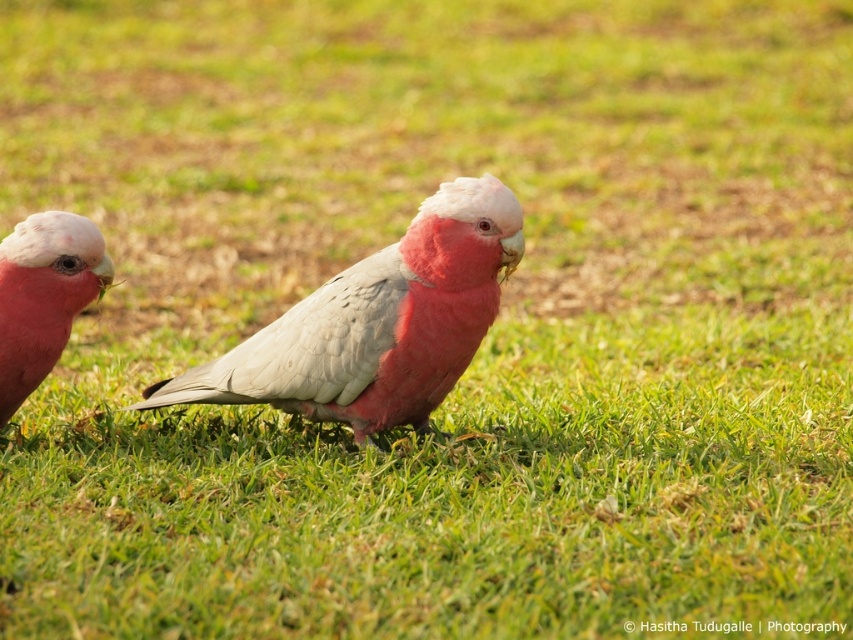
Question: Among these points, which one is nearest to the camera?

Choices:
 (A) (457, 182)
 (B) (77, 300)

Answer: (A)

Question: Does pink matte parrot at center appear under pink matte parrot at left?

Choices:
 (A) yes
 (B) no

Answer: (A)

Question: Which object appears closest to the camera in this image?

Choices:
 (A) pink matte parrot at center
 (B) pink matte parrot at left

Answer: (A)

Question: Is pink matte parrot at center behind pink matte parrot at left?

Choices:
 (A) yes
 (B) no

Answer: (B)

Question: Can you confirm if pink matte parrot at center is positioned above pink matte parrot at left?

Choices:
 (A) no
 (B) yes

Answer: (A)